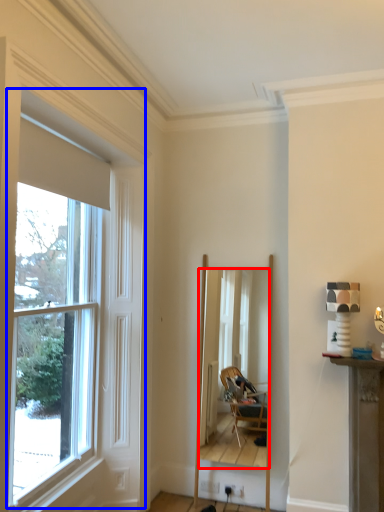
Question: Which object appears farthest to the camera in this image, mirror (highlighted by a red box) or window (highlighted by a blue box)?

Choices:
 (A) mirror
 (B) window

Answer: (A)